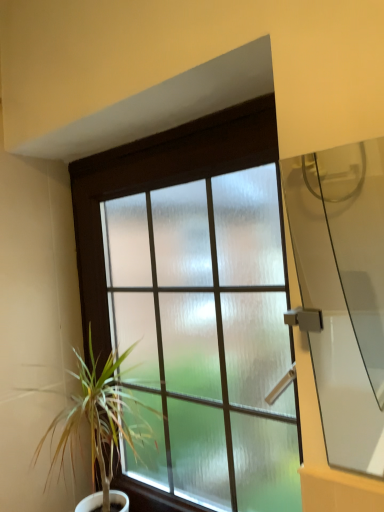
What is the approximate width of frosted glass window at center?

frosted glass window at center is 4.36 inches wide.

I want to click on frosted glass window at center, so click(196, 302).

Which is closer, [234,432] or [102,395]?

Point [234,432] is closer to the camera than point [102,395].

Is frosted glass window at center touching green leafy plant at left?

They are not placed beside each other.

Does frosted glass window at center have a smaller size compared to green leafy plant at left?

No, frosted glass window at center is not smaller than green leafy plant at left.

Does frosted glass window at center lie behind green leafy plant at left?

That is False.

Can you confirm if transparent glass door at right is positioned to the right of green leafy plant at left?

Yes.

Which of these two, transparent glass door at right or green leafy plant at left, is thinner?

transparent glass door at right.

Between point (334, 205) and point (150, 438), which one is positioned behind?

Positioned behind is point (334, 205).

Is transparent glass door at right not within green leafy plant at left?

That's correct, transparent glass door at right is outside of green leafy plant at left.

Would you say transparent glass door at right is inside or outside frosted glass window at center?

transparent glass door at right cannot be found inside frosted glass window at center.

Between transparent glass door at right and frosted glass window at center, which one appears on the right side from the viewer's perspective?

transparent glass door at right is more to the right.

Considering the sizes of objects transparent glass door at right and frosted glass window at center in the image provided, who is smaller, transparent glass door at right or frosted glass window at center?

transparent glass door at right.

Are transparent glass door at right and frosted glass window at center making contact?

There is a gap between transparent glass door at right and frosted glass window at center.

Looking at their sizes, would you say green leafy plant at left is wider or thinner than frosted glass window at center?

Considering their sizes, green leafy plant at left looks broader than frosted glass window at center.

Could frosted glass window at center be considered to be inside green leafy plant at left?

No, frosted glass window at center is not surrounded by green leafy plant at left.

Can you confirm if green leafy plant at left is smaller than frosted glass window at center?

Indeed, green leafy plant at left has a smaller size compared to frosted glass window at center.

From the picture: Is green leafy plant at left placed right next to frosted glass window at center?

No.

Who is taller, green leafy plant at left or transparent glass door at right?

With more height is green leafy plant at left.

Considering the sizes of green leafy plant at left and transparent glass door at right in the image, is green leafy plant at left wider or thinner than transparent glass door at right?

Considering their sizes, green leafy plant at left looks broader than transparent glass door at right.

From the image's perspective, which is above, green leafy plant at left or transparent glass door at right?

transparent glass door at right, from the image's perspective.

Locate an element on the screen. This screenshot has width=384, height=512. houseplant behind the transparent glass door at right is located at coordinates (100, 422).

From a real-world perspective, who is located higher, frosted glass window at center or transparent glass door at right?

In real-world perspective, transparent glass door at right is above.

From the image's perspective, is frosted glass window at center positioned above or below transparent glass door at right?

frosted glass window at center is situated lower than transparent glass door at right in the image.

Considering the sizes of objects frosted glass window at center and transparent glass door at right in the image provided, who is smaller, frosted glass window at center or transparent glass door at right?

With smaller size is transparent glass door at right.

I want to click on houseplant directly beneath the frosted glass window at center (from a real-world perspective), so click(100, 422).

This screenshot has width=384, height=512. I want to click on window screen above the green leafy plant at left (from a real-world perspective), so click(x=343, y=291).

Based on the photo, when comparing their distances from transparent glass door at right, does frosted glass window at center or green leafy plant at left seem closer?

frosted glass window at center is positioned closer to the anchor transparent glass door at right.

From the image, which object appears to be farther from green leafy plant at left, frosted glass window at center or transparent glass door at right?

Among the two, transparent glass door at right is located further to green leafy plant at left.

Based on their spatial positions, is green leafy plant at left or transparent glass door at right further from frosted glass window at center?

transparent glass door at right is further to frosted glass window at center.

Based on their spatial positions, is transparent glass door at right or green leafy plant at left further from frosted glass window at center?

transparent glass door at right is positioned further to the anchor frosted glass window at center.

In the scene shown: Looking at the image, which one is located closer to transparent glass door at right, green leafy plant at left or frosted glass window at center?

frosted glass window at center.

Which object lies further to the anchor point green leafy plant at left, transparent glass door at right or frosted glass window at center?

Based on the image, transparent glass door at right appears to be further to green leafy plant at left.

Where is `window located between green leafy plant at left and transparent glass door at right in the left-right direction`? The width and height of the screenshot is (384, 512). window located between green leafy plant at left and transparent glass door at right in the left-right direction is located at coordinates (196, 302).